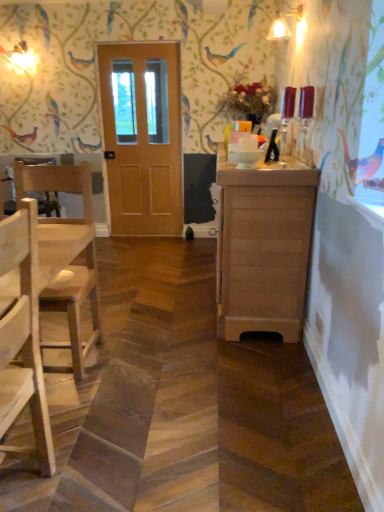
Question: Can you confirm if wooden cabinet at right is positioned to the left of natural wood chair at left, the 2th chair in the front-to-back sequence?

Choices:
 (A) yes
 (B) no

Answer: (B)

Question: Is wooden cabinet at right beside natural wood chair at left, the 1th chair when ordered from back to front?

Choices:
 (A) yes
 (B) no

Answer: (B)

Question: From the image's perspective, is wooden cabinet at right on top of natural wood chair at left, the 2th chair in the front-to-back sequence?

Choices:
 (A) no
 (B) yes

Answer: (B)

Question: Is the depth of wooden cabinet at right less than that of natural wood chair at left, the 2th chair in the front-to-back sequence?

Choices:
 (A) no
 (B) yes

Answer: (A)

Question: From a real-world perspective, is wooden cabinet at right located beneath natural wood chair at left, the 2th chair in the front-to-back sequence?

Choices:
 (A) no
 (B) yes

Answer: (B)

Question: Is natural wood chair at left, arranged as the first chair when viewed from the front, spatially inside natural wood chair at left, the 1th chair when ordered from back to front, or outside of it?

Choices:
 (A) inside
 (B) outside

Answer: (B)

Question: Is point (11, 229) closer or farther from the camera than point (43, 183)?

Choices:
 (A) farther
 (B) closer

Answer: (B)

Question: Considering the relative positions of natural wood chair at left, placed as the 2th chair when sorted from back to front, and natural wood chair at left, the 1th chair when ordered from back to front, in the image provided, is natural wood chair at left, placed as the 2th chair when sorted from back to front, to the left or to the right of natural wood chair at left, the 1th chair when ordered from back to front,?

Choices:
 (A) right
 (B) left

Answer: (A)

Question: From the image's perspective, is natural wood chair at left, arranged as the first chair when viewed from the front, positioned above or below natural wood chair at left, the 2th chair in the front-to-back sequence?

Choices:
 (A) above
 (B) below

Answer: (B)

Question: From the image's perspective, is wooden door at center positioned above or below natural wood chair at left, arranged as the first chair when viewed from the front?

Choices:
 (A) below
 (B) above

Answer: (B)

Question: Is wooden door at center in front of or behind natural wood chair at left, arranged as the first chair when viewed from the front, in the image?

Choices:
 (A) behind
 (B) front

Answer: (A)

Question: Does point (122, 112) appear closer or farther from the camera than point (16, 369)?

Choices:
 (A) farther
 (B) closer

Answer: (A)

Question: Is wooden door at center bigger or smaller than natural wood chair at left, arranged as the first chair when viewed from the front?

Choices:
 (A) big
 (B) small

Answer: (A)

Question: From their relative heights in the image, would you say natural wood chair at left, arranged as the first chair when viewed from the front, is taller or shorter than wooden cabinet at right?

Choices:
 (A) short
 (B) tall

Answer: (B)

Question: From the image's perspective, is natural wood chair at left, placed as the 2th chair when sorted from back to front, above or below wooden cabinet at right?

Choices:
 (A) above
 (B) below

Answer: (B)